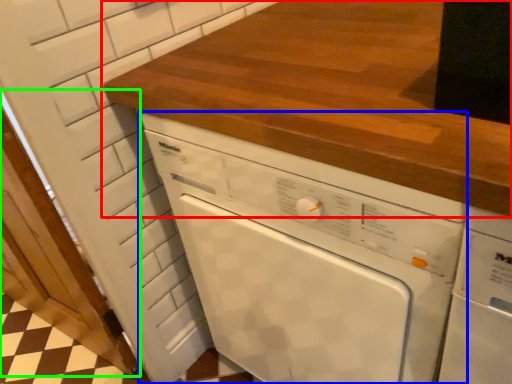
Question: Estimate the real-world distances between objects in this image. Which object is closer to countertop (highlighted by a red box), home appliance (highlighted by a blue box) or door (highlighted by a green box)?

Choices:
 (A) home appliance
 (B) door

Answer: (A)